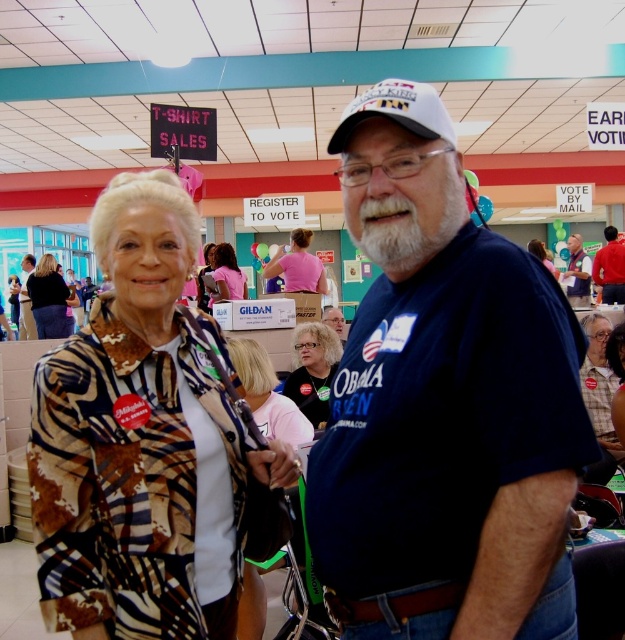
You are an observer looking at the scene. Which object is located below the other between the printed fabric jacket at left and the printed fabric blouse at center?

The printed fabric jacket at left is positioned under the printed fabric blouse at center.